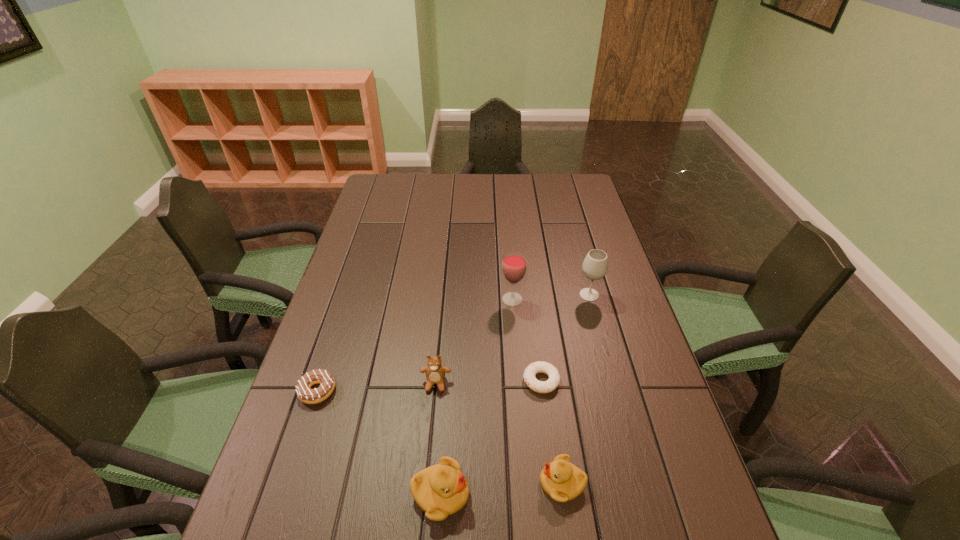
Locate an element on the screen. the left duckling is located at coordinates (440, 490).

Identify the location of the third shortest object. (563, 481).

This screenshot has height=540, width=960. I want to click on the right duckling, so click(563, 481).

The width and height of the screenshot is (960, 540). I want to click on the left wineglass, so click(514, 264).

Image resolution: width=960 pixels, height=540 pixels. What are the coordinates of `the left doughnut` in the screenshot? It's located at (323, 377).

At what (x,y) coordinates should I click in order to perform the action: click on the second shortest object. Please return your answer as a coordinate pair (x, y). The width and height of the screenshot is (960, 540). Looking at the image, I should click on (323, 377).

The height and width of the screenshot is (540, 960). Identify the location of the rightmost object. (595, 266).

The image size is (960, 540). Find the location of `teddy bear`. teddy bear is located at coordinates (435, 372).

In order to click on the shorter doughnut in this screenshot , I will do click(551, 384).

The height and width of the screenshot is (540, 960). Identify the location of the right doughnut. click(x=551, y=384).